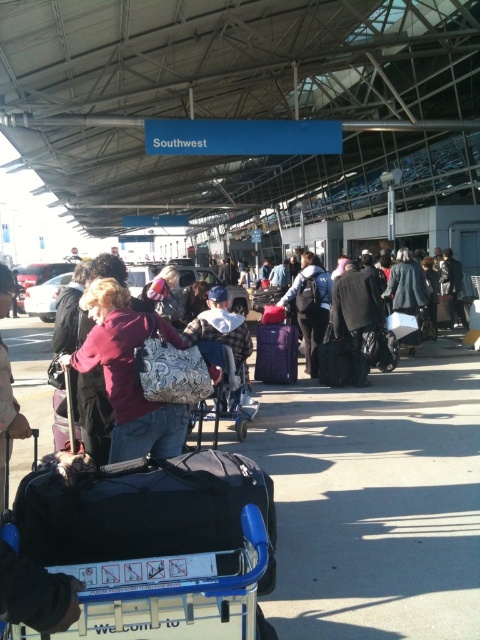
What is the color of the object located at point (128, 372) in the image?

The object at point (128, 372) is a matte maroon coat at center.

You are a traveler at the airport. You have a matte maroon coat at center and a matte purple suitcase at center. Which item is wider?

Result: The matte maroon coat at center is wider than the matte purple suitcase at center.

Consider the image. You are a traveler at the airport and need to decide which item to place on the overhead compartment. The overhead compartment has limited space. Which item between the black fuzzy coat at center and the matte purple suitcase at center should you choose to fit better?

The matte purple suitcase at center is smaller than the black fuzzy coat at center, so it would fit better in the overhead compartment with limited space.